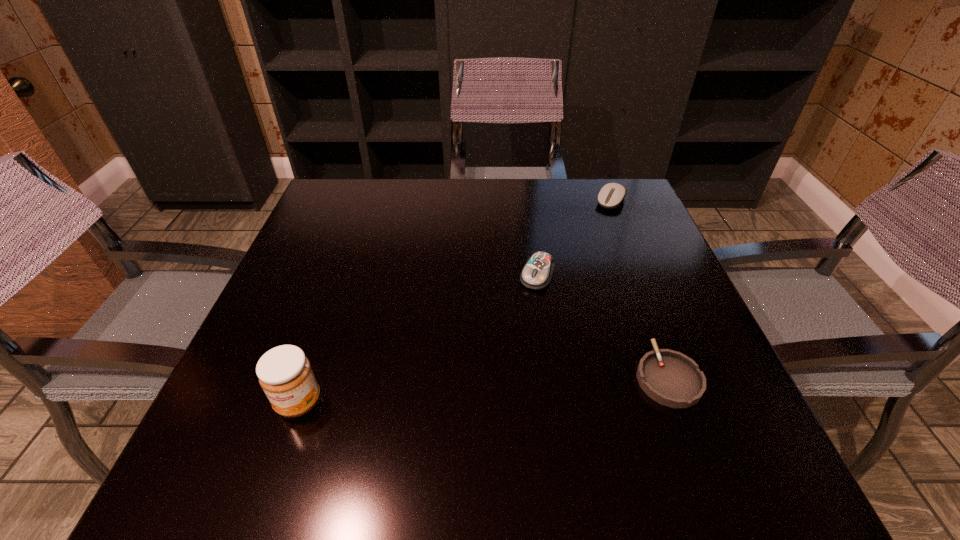
Select which object is the second closest to the farthest object. Please provide its 2D coordinates. Your answer should be formatted as a tuple, i.e. [(x, y)], where the tuple contains the x and y coordinates of a point satisfying the conditions above.

[(672, 379)]

You are a GUI agent. You are given a task and a screenshot of the screen. Output one action in this format:
    pyautogui.click(x=<x>, y=<y>)
    Task: Click on the free region that satisfies the following two spatial constraints: 1. on the back side of the farther computer mouse; 2. on the right side of the ashtray
    
    Given the screenshot: What is the action you would take?
    pos(602,201)